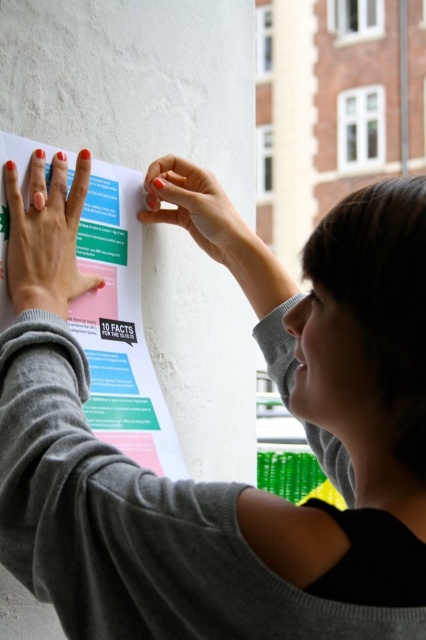
Which of these two, matte pink nail polish at upper left or nail polish coated finger at upper center, stands taller?

With more height is matte pink nail polish at upper left.

Is matte pink nail polish at upper left positioned before nail polish coated finger at upper center?

That is True.

Between point (52, 291) and point (201, 205), which one is positioned behind?

The point (201, 205) is behind.

The width and height of the screenshot is (426, 640). In order to click on matte pink nail polish at upper left in this screenshot , I will do `click(46, 236)`.

Is white paper poster at upper left to the right of matte pink nail polish at upper left from the viewer's perspective?

Yes, white paper poster at upper left is to the right of matte pink nail polish at upper left.

Is point (121, 244) farther from camera compared to point (14, 248)?

Yes, it is.

What do you see at coordinates (120, 324) in the screenshot?
I see `white paper poster at upper left` at bounding box center [120, 324].

Where is `white paper poster at upper left`? white paper poster at upper left is located at coordinates (120, 324).

Who is positioned more to the left, white paper poster at upper left or nail polish coated finger at upper center?

From the viewer's perspective, white paper poster at upper left appears more on the left side.

Is point (94, 387) positioned before point (192, 188)?

Yes.

Where is `white paper poster at upper left`? white paper poster at upper left is located at coordinates [x=120, y=324].